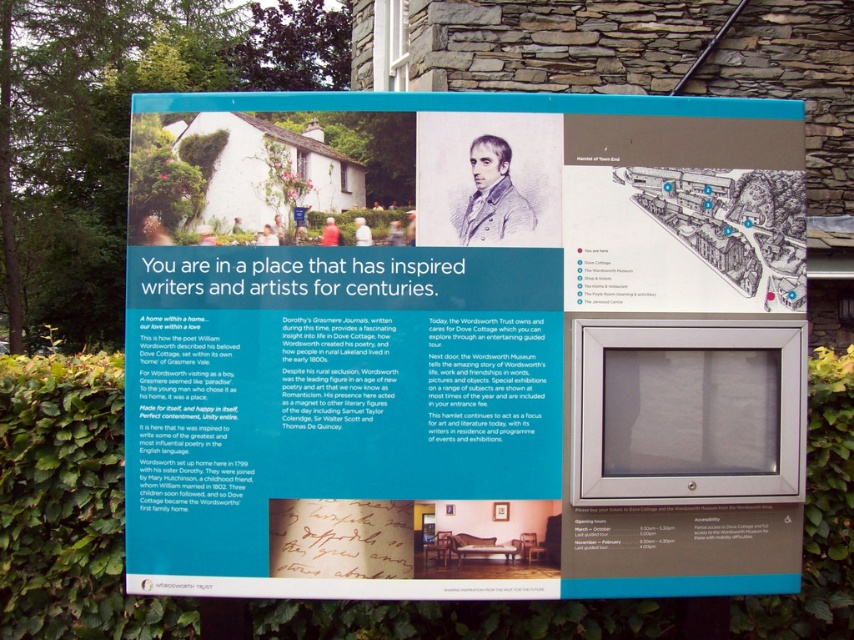
Question: In this image, where is white paper at center located relative to green leafy hedge at lower left?

Choices:
 (A) below
 (B) above

Answer: (B)

Question: Which object appears closest to the camera in this image?

Choices:
 (A) green leafy hedge at lower left
 (B) white paper at center

Answer: (B)

Question: Which point is farther to the camera?

Choices:
 (A) (806, 477)
 (B) (249, 365)

Answer: (A)

Question: Which object is closer to the camera taking this photo?

Choices:
 (A) green leafy hedge at lower left
 (B) white paper at center

Answer: (B)

Question: Considering the relative positions of white paper at center and green leafy hedge at lower left in the image provided, where is white paper at center located with respect to green leafy hedge at lower left?

Choices:
 (A) right
 (B) left

Answer: (A)

Question: Does white paper at center have a greater width compared to green leafy hedge at lower left?

Choices:
 (A) yes
 (B) no

Answer: (A)